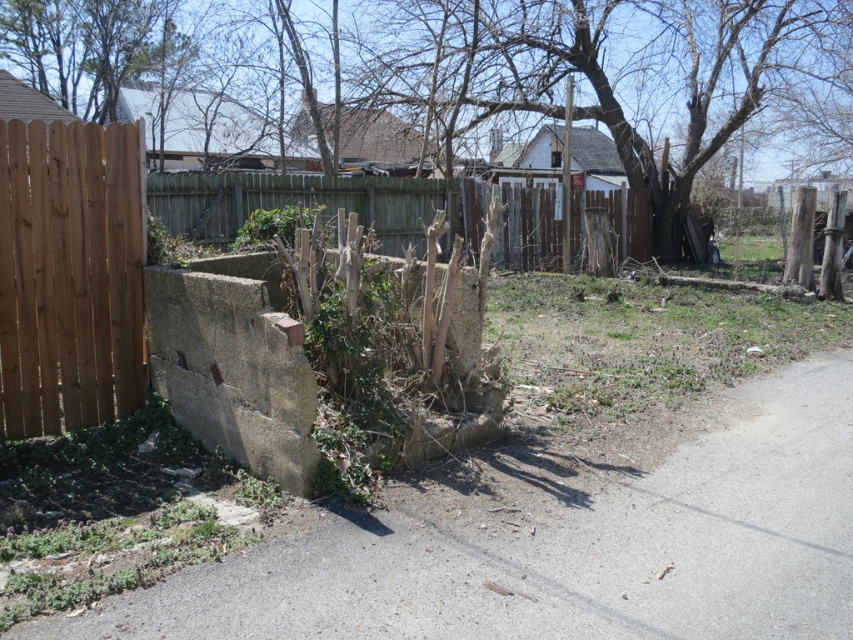
You are a gardener assessing the yard. You see the brown wood tree at center and the brown wooden fence at center. Which object would require more space to accommodate its current size?

The brown wood tree at center is larger in size than the brown wooden fence at center, so it would require more space to accommodate its current size.

You are standing at the point with coordinates point (618,72) in the residential area scene. What object are you directly facing?

The point (618,72) corresponds to the brown wood tree at center, so you are directly facing the brown wood tree at center.

You are a delivery person standing at the brown wooden fence at left, and you need to deliver a package to the brown wood tree at center. The package requires a clear path without obstacles. Can you walk directly to the tree from the fence without any obstructions?

The distance between the brown wood tree at center and the brown wooden fence at left is 14.53 meters, but the scene description mentions an overgrown yard with vegetation covering the retaining wall and surrounding areas. This suggests potential obstacles like weeds and grass patches, so the path might not be completely clear. However, the question specifies focusing on the distance provided in the Objects Description. Since the distance is given and no explicit mention of obstacles blocking the directpath